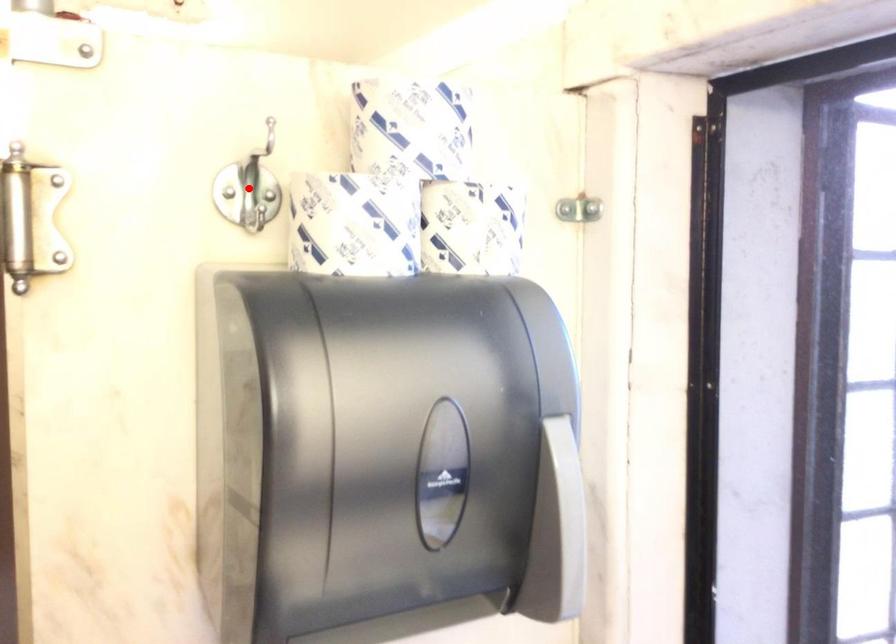
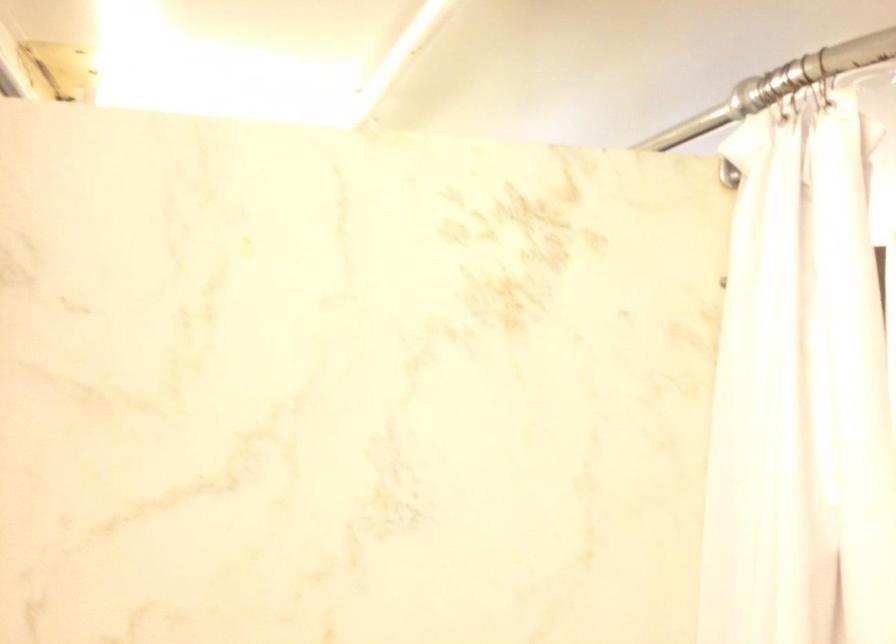
Question: I am providing you with two images of the same scene from different viewpoints. A red point is marked on the first image. Is the red point's position out of view in image 2?

Choices:
 (A) Yes
 (B) No

Answer: (A)